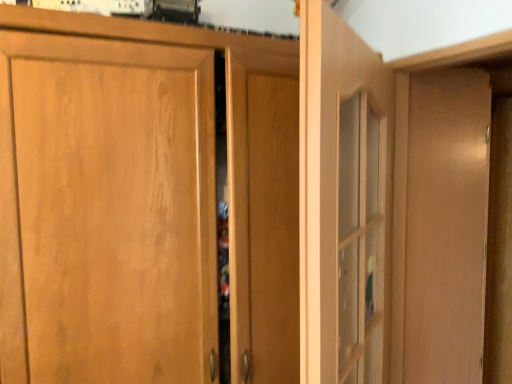
Question: Is wooden cabinet door at center, marked as the first door in a left-to-right arrangement, placed right next to matte wood dresser at right?

Choices:
 (A) yes
 (B) no

Answer: (B)

Question: Is matte wood dresser at right at the back of wooden cabinet door at center, the second door viewed from the right?

Choices:
 (A) yes
 (B) no

Answer: (B)

Question: Is matte wood dresser at right located within wooden cabinet door at center, marked as the first door in a left-to-right arrangement?

Choices:
 (A) yes
 (B) no

Answer: (B)

Question: Can you confirm if wooden cabinet door at center, marked as the first door in a left-to-right arrangement, is thinner than matte wood dresser at right?

Choices:
 (A) yes
 (B) no

Answer: (B)

Question: From a real-world perspective, is wooden cabinet door at center, the second door viewed from the right, physically above matte wood dresser at right?

Choices:
 (A) no
 (B) yes

Answer: (A)

Question: Is matte wood dresser at right bigger or smaller than clear glass door at center, the first door from the right?

Choices:
 (A) big
 (B) small

Answer: (B)

Question: Would you say matte wood dresser at right is to the left or to the right of clear glass door at center, the second door viewed from the left, in the picture?

Choices:
 (A) left
 (B) right

Answer: (B)

Question: Is matte wood dresser at right wider or thinner than clear glass door at center, the second door viewed from the left?

Choices:
 (A) thin
 (B) wide

Answer: (A)

Question: From a real-world perspective, is matte wood dresser at right physically located above or below clear glass door at center, the second door viewed from the left?

Choices:
 (A) above
 (B) below

Answer: (B)

Question: In terms of width, does wooden cabinet door at center, marked as the first door in a left-to-right arrangement, look wider or thinner when compared to clear glass door at center, the second door viewed from the left?

Choices:
 (A) wide
 (B) thin

Answer: (A)

Question: Considering the positions of point (48, 379) and point (302, 170), is point (48, 379) closer or farther from the camera than point (302, 170)?

Choices:
 (A) closer
 (B) farther

Answer: (B)

Question: Which is correct: wooden cabinet door at center, marked as the first door in a left-to-right arrangement, is inside clear glass door at center, the second door viewed from the left, or outside of it?

Choices:
 (A) inside
 (B) outside

Answer: (B)

Question: Is wooden cabinet door at center, marked as the first door in a left-to-right arrangement, bigger or smaller than clear glass door at center, the first door from the right?

Choices:
 (A) big
 (B) small

Answer: (A)

Question: Is clear glass door at center, the second door viewed from the left, in front of or behind wooden cabinet door at center, marked as the first door in a left-to-right arrangement, in the image?

Choices:
 (A) front
 (B) behind

Answer: (A)

Question: Considering the positions of clear glass door at center, the second door viewed from the left, and wooden cabinet door at center, marked as the first door in a left-to-right arrangement, in the image, is clear glass door at center, the second door viewed from the left, wider or thinner than wooden cabinet door at center, marked as the first door in a left-to-right arrangement,?

Choices:
 (A) thin
 (B) wide

Answer: (A)